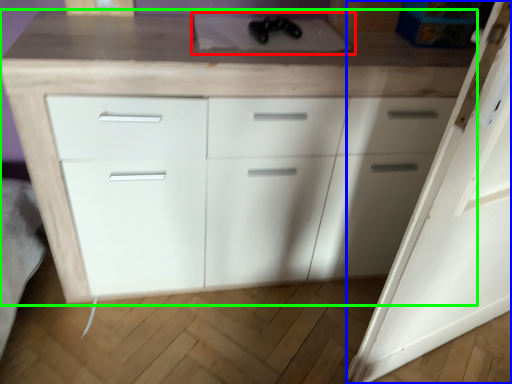
Question: Which is farther away from sink (highlighted by a red box)? door (highlighted by a blue box) or chest of drawers (highlighted by a green box)?

Choices:
 (A) door
 (B) chest of drawers

Answer: (A)